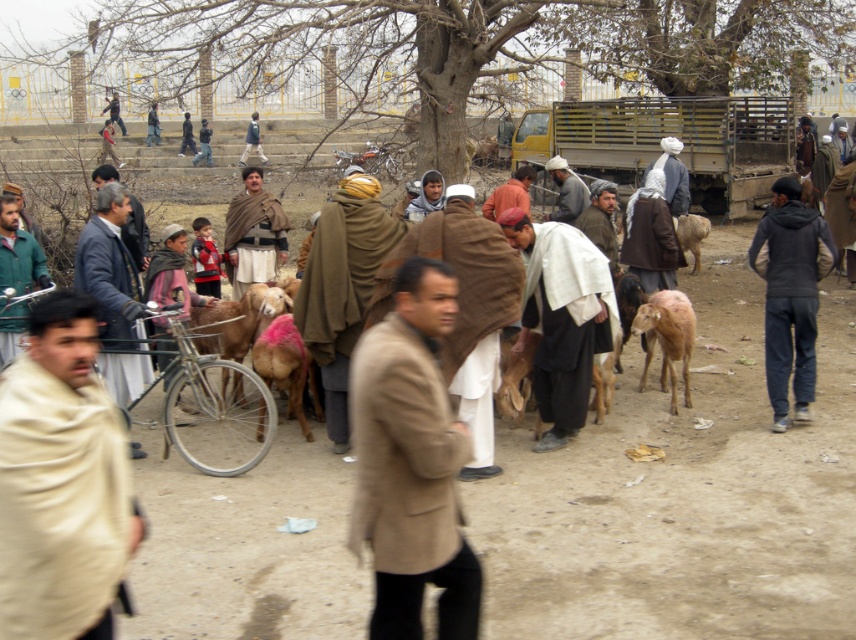
Question: From the image, what is the correct spatial relationship of light brown woolen goat at center in relation to brown woolen robe at center?

Choices:
 (A) left
 (B) right

Answer: (B)

Question: Which of these objects is positioned farthest from the light brown woolen sweater at center?

Choices:
 (A) brown woolen jacket at center
 (B) light brown woolen goat at center
 (C) brown woolen coat at center
 (D) pink woolen sheep at center

Answer: (C)

Question: Is light brown woolen goat at center positioned at the back of light brown woolen sweater at center?

Choices:
 (A) no
 (B) yes

Answer: (A)

Question: Which point is farther from the camera taking this photo?

Choices:
 (A) (520, 358)
 (B) (244, 160)

Answer: (B)

Question: Considering the relative positions of white woolen robe at center and brown woolen robe at center in the image provided, where is white woolen robe at center located with respect to brown woolen robe at center?

Choices:
 (A) below
 (B) above

Answer: (A)

Question: Which object is closer to the camera taking this photo?

Choices:
 (A) beige woolen shawl at center
 (B) light brown woolen sweater at center
 (C) light brown woolen coat at center

Answer: (A)